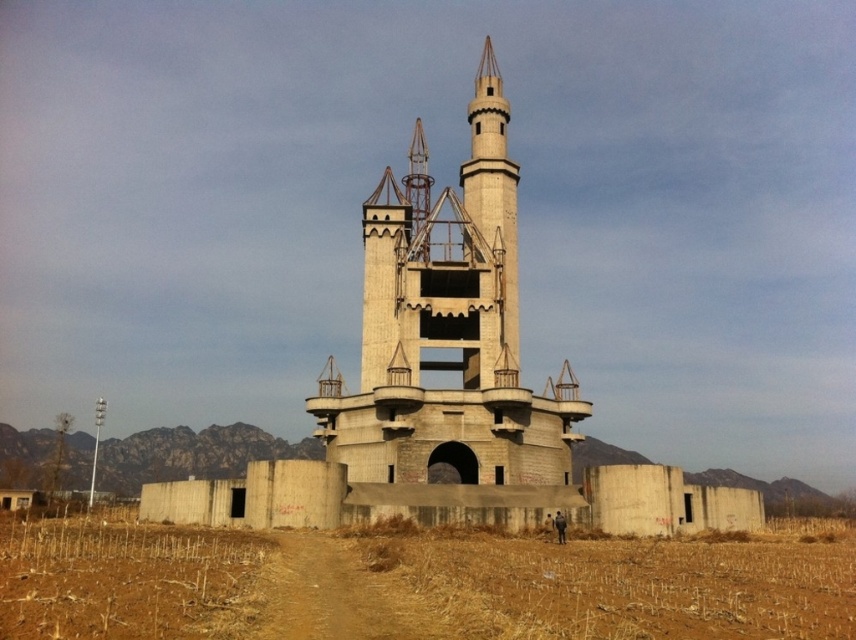
Question: Can you confirm if concretecastle at center is smaller than concrete tower at center?

Choices:
 (A) no
 (B) yes

Answer: (A)

Question: Which object appears farthest from the camera in this image?

Choices:
 (A) brown dry grass at lower center
 (B) concretecastle at center
 (C) brown dirt track at lower center
 (D) concrete tower at center

Answer: (D)

Question: Can you confirm if concretecastle at center is thinner than concrete tower at center?

Choices:
 (A) yes
 (B) no

Answer: (B)

Question: Is concretecastle at center in front of concrete tower at center?

Choices:
 (A) yes
 (B) no

Answer: (A)

Question: Among these points, which one is nearest to the camera?

Choices:
 (A) (424, 422)
 (B) (355, 627)
 (C) (503, 113)
 (D) (37, 612)

Answer: (B)

Question: Which object appears farthest from the camera in this image?

Choices:
 (A) brown dirt track at lower center
 (B) concretecastle at center
 (C) brown dry grass at lower center

Answer: (B)